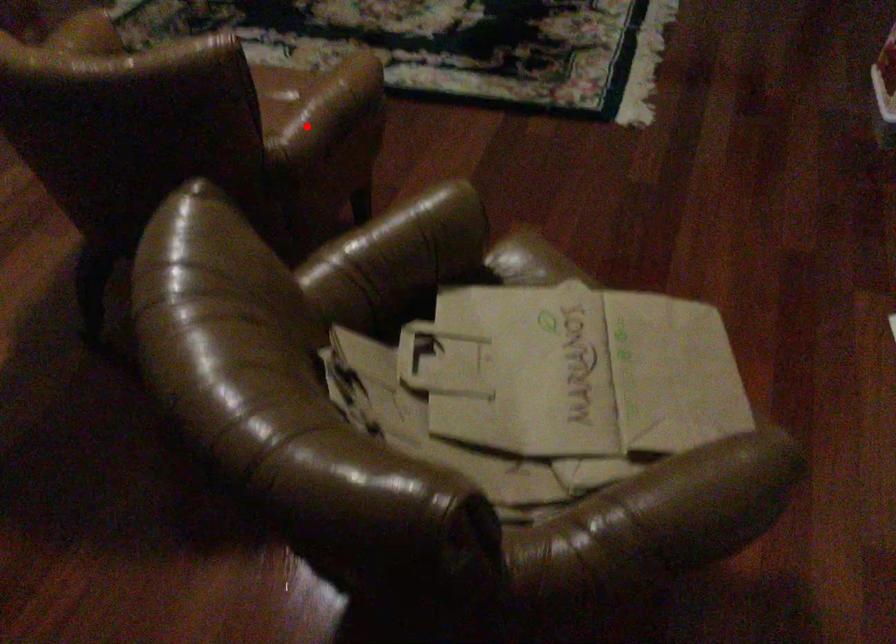
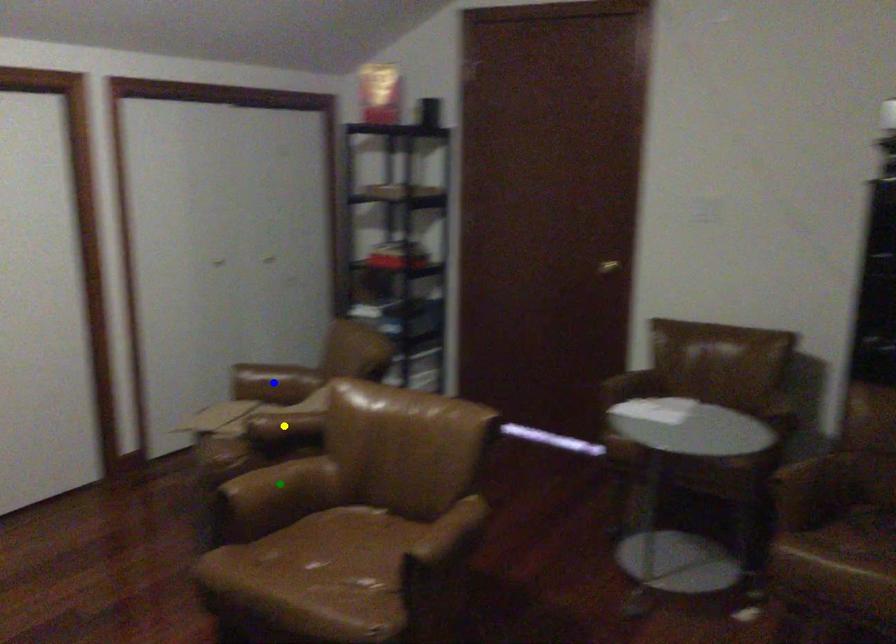
Question: I am providing you with two images of the same scene from different viewpoints. A red point is marked on the first image. You are given multiple points on the second image. Which point in image 2 is actually the same real-world point as the red point in image 1?

Choices:
 (A) green point
 (B) yellow point
 (C) blue point

Answer: (A)